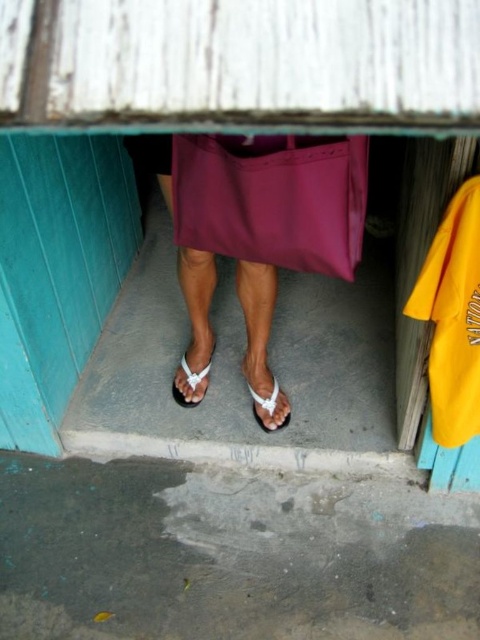
You are a delivery person trying to deliver a package to someone standing under a teal shelter. You see the white plastic sandals at center and the matte purple dress at center. Which item is closer to the ground?

The white plastic sandals at center is positioned under the matte purple dress at center, so it is closer to the ground.

You are a delivery person who needs to place a small package on the ground near the white plastic sandals at center and matte purple dress at center. Since the ground outside the shelter is wet, where should you place the package to keep it dry?

The white plastic sandals at center is positioned on the left side of matte purple dress at center. To keep the package dry, place it between the white plastic sandals at center and the matte purple dress at center, as the area under the shelter is dry while the ground outside is wet.